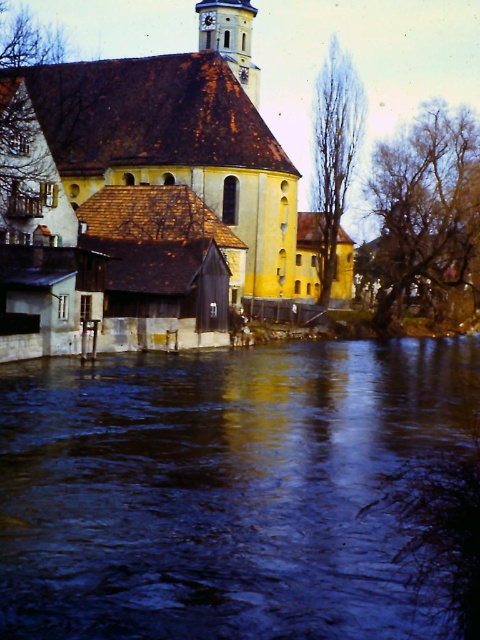
Consider the image. You are a tourist standing at the riverside and want to take a photo of the yellow matte church at center and the white stucco clock tower at upper center. If your camera can capture objects within a 20 meter range, will both structures be in the same photo?

The yellow matte church at center is 18.76 meters from the white stucco clock tower at upper center, so both structures will be within the camera range and appear in the same photo.

You are standing at the riverside and want to take a photo of the white stucco clock tower at upper center without the blue water at center blocking the view. Is this possible based on their positions?

The blue water at center is in front of the white stucco clock tower at upper center, so it would block the view. To capture the clock tower without the water in front, you would need to adjust your position or angle to ensure the water is not between you and the tower.